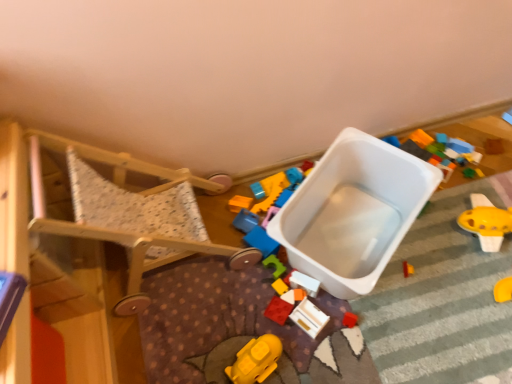
I want to click on free space to the right of rubberized red block at center, which appears as the fifth toy when viewed from the right, so click(x=340, y=310).